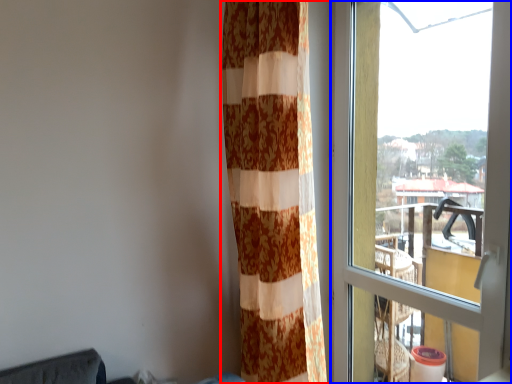
Question: Which point is further to the camera, curtain (highlighted by a red box) or window (highlighted by a blue box)?

Choices:
 (A) curtain
 (B) window

Answer: (A)